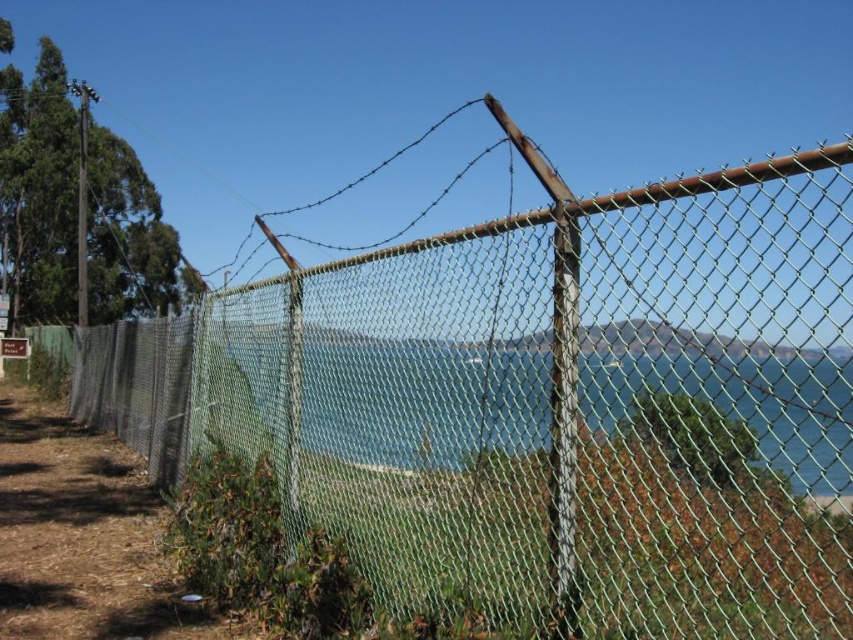
Can you confirm if green mesh fence at center is positioned below green mesh fence at lower left?

Indeed, green mesh fence at center is positioned under green mesh fence at lower left.

Who is more forward, (259, 326) or (16, 404)?

Point (259, 326)

Is point (231, 380) farther from viewer compared to point (22, 493)?

No, it is in front of (22, 493).

The image size is (853, 640). Identify the location of green mesh fence at center. (743, 404).